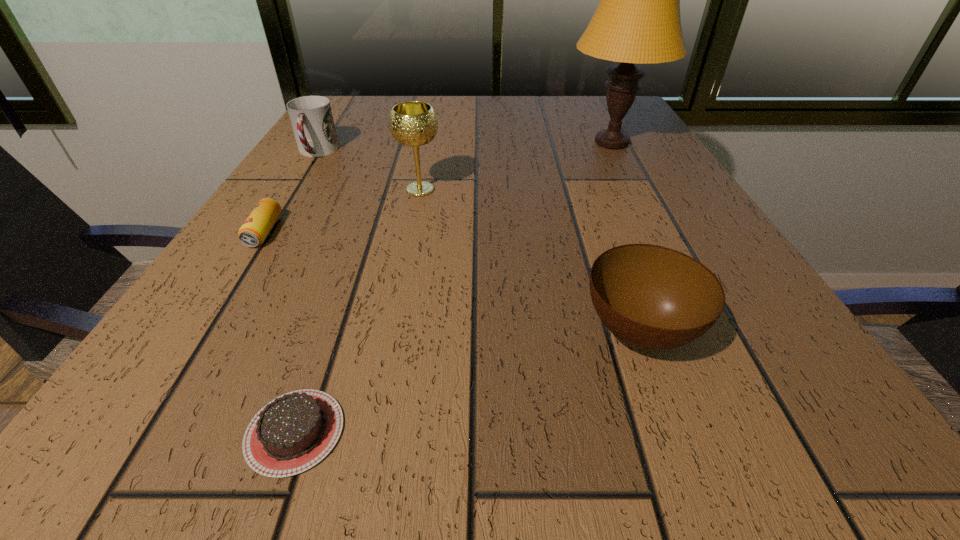
Identify the location of free region at the far right corner of the desktop. The image size is (960, 540). (598, 106).

Find the location of a particular element. The image size is (960, 540). vacant space at the near right corner of the desktop is located at coordinates (852, 458).

This screenshot has height=540, width=960. I want to click on free space between the cup and the lampshade, so click(x=464, y=147).

Find the location of a particular element. The height and width of the screenshot is (540, 960). blank region between the chocolate cake and the lampshade is located at coordinates (453, 287).

The image size is (960, 540). Identify the location of empty space between the tallest object and the third nearest object. (438, 187).

I want to click on vacant point located between the third shortest object and the tallest object, so click(x=625, y=237).

Find the location of a particular element. The image size is (960, 540). vacant region between the chocolate cake and the fourth nearest object is located at coordinates (357, 310).

Where is `free space between the cup and the shortest object`? This screenshot has width=960, height=540. free space between the cup and the shortest object is located at coordinates [306, 292].

Where is `vacant space in between the chalice and the third nearest object`? This screenshot has height=540, width=960. vacant space in between the chalice and the third nearest object is located at coordinates (342, 211).

You are a GUI agent. You are given a task and a screenshot of the screen. Output one action in this format:
    pyautogui.click(x=<x>, y=<y>)
    Task: Click on the vacant point located between the lampshade and the fourth tallest object
    
    Given the screenshot: What is the action you would take?
    pyautogui.click(x=625, y=237)